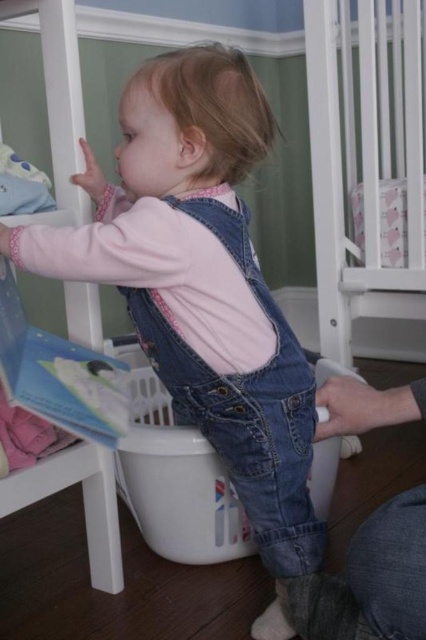
You are trying to place a new toy box in the nursery. The toy box is 1.2 meters wide. You see the denim overalls at center and the white plastic laundry basket at center. Based on their widths, can the toy box fit between them?

The denim overalls at center might be wider than white plastic laundry basket at center. Since the toy box is 1.2 meters wide, but the exact width between the denim overalls at center and white plastic laundry basket at center isn

You are a parent trying to place a new toy in the nursery. The toy requires a spot that is not occupied by the denim overalls at center. Based on the image, where should you place the toy?

The denim overalls at center is located at point (201, 282), so you should place the toy in an area not overlapping with that coordinate.